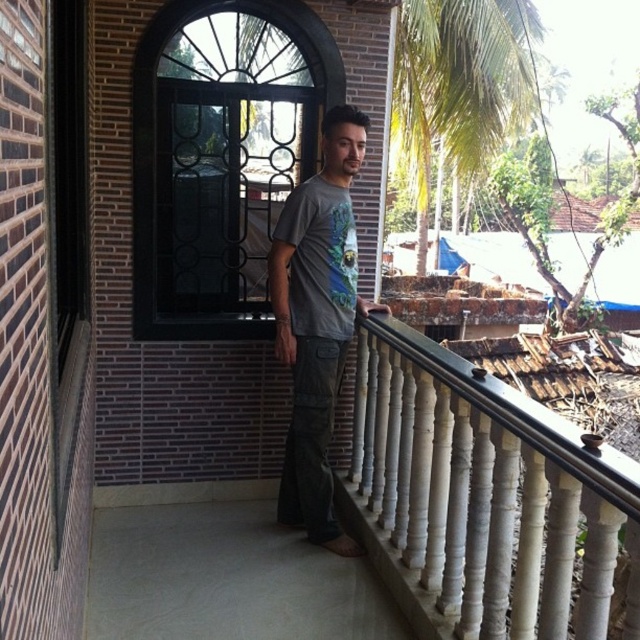
Is white painted wood balustrade at center positioned before black glass window at center?

Yes, white painted wood balustrade at center is in front of black glass window at center.

Measure the distance between white painted wood balustrade at center and black glass window at center.

white painted wood balustrade at center is 4.47 feet away from black glass window at center.

Find the location of a particular element. white painted wood balustrade at center is located at coordinates (483, 499).

Can you confirm if black glass window at center is positioned below gray cotton t-shirt at center?

No, black glass window at center is not below gray cotton t-shirt at center.

In the scene shown: Who is more forward, (237, 141) or (337, 124)?

Positioned in front is point (337, 124).

The image size is (640, 640). What are the coordinates of `black glass window at center` in the screenshot? It's located at (214, 172).

Who is more forward, [312,29] or [419,243]?

Positioned in front is point [312,29].

Which is below, black glass window at center or green leafy palm tree at upper right?

black glass window at center

Is point (224, 195) closer to camera compared to point (490, 35)?

Yes, it is.

Locate an element on the screen. black glass window at center is located at coordinates (214, 172).